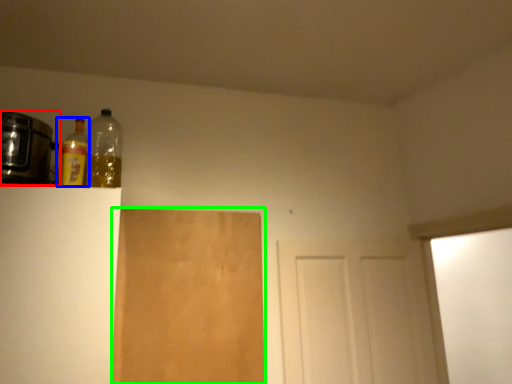
Question: Based on their relative distances, which object is farther from appliance (highlighted by a red box)? Choose from bottle (highlighted by a blue box) and plywood (highlighted by a green box).

Choices:
 (A) bottle
 (B) plywood

Answer: (B)